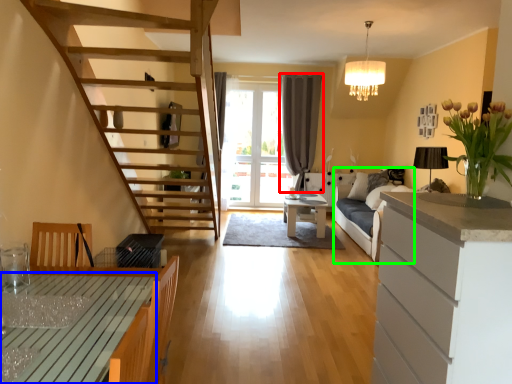
Question: Which object is the closest to the curtain (highlighted by a red box)? Choose among these: table (highlighted by a blue box) or couch (highlighted by a green box).

Choices:
 (A) table
 (B) couch

Answer: (B)